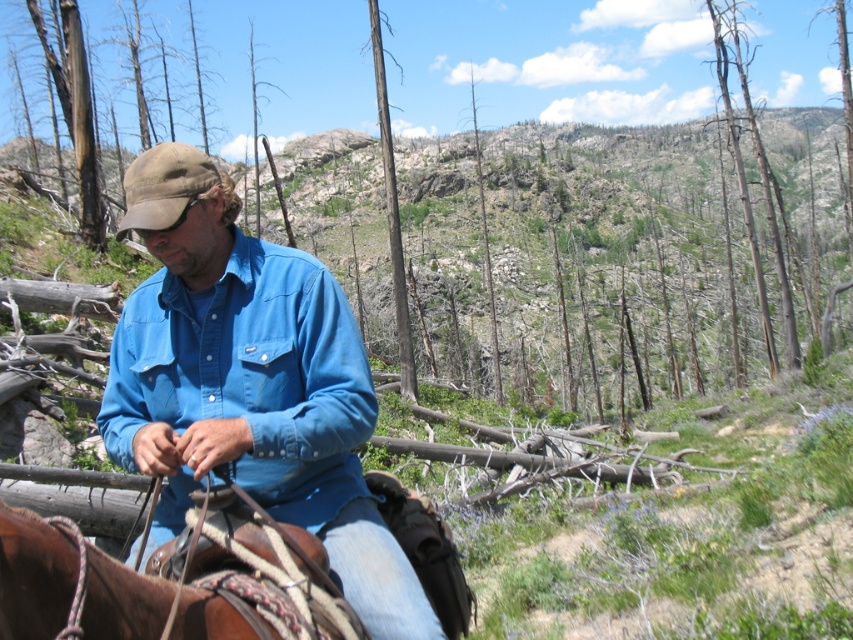
Who is positioned more to the left, brown leather saddle at lower left or dead wood at center?

Positioned to the left is brown leather saddle at lower left.

Between brown leather saddle at lower left and dead wood at center, which one appears on the right side from the viewer's perspective?

From the viewer's perspective, dead wood at center appears more on the right side.

This screenshot has height=640, width=853. I want to click on brown leather saddle at lower left, so click(x=157, y=589).

Based on the photo, is matte blue shirt at center thinner than brown rough bark tree at center?

Yes, matte blue shirt at center is thinner than brown rough bark tree at center.

Identify the location of matte blue shirt at center. (248, 384).

Locate an element on the screen. The width and height of the screenshot is (853, 640). matte blue shirt at center is located at coordinates (248, 384).

Between dead wood at upper right and brown rough bark tree at center, which one is positioned higher?

dead wood at upper right is above.

Is point (769, 339) in front of point (393, 285)?

That is True.

Find the location of `dead wood at upper right`. dead wood at upper right is located at coordinates (741, 182).